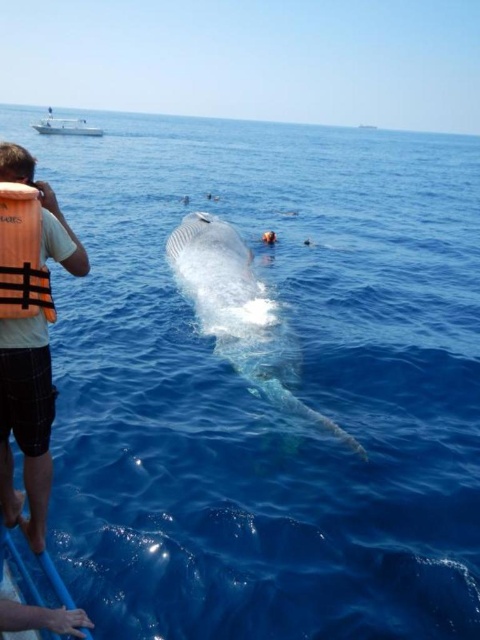
Is orange life vest at left bigger than gray matte whale at center?

No, orange life vest at left is not bigger than gray matte whale at center.

Does orange life vest at left have a smaller size compared to gray matte whale at center?

Indeed, orange life vest at left has a smaller size compared to gray matte whale at center.

Between point (0, 460) and point (172, 250), which one is positioned in front?

Positioned in front is point (0, 460).

What are the coordinates of `orange life vest at left` in the screenshot? It's located at (25, 420).

What do you see at coordinates (25, 420) in the screenshot? I see `orange life vest at left` at bounding box center [25, 420].

Can you confirm if orange life vest at left is shorter than orange fabric life jacket at left?

No.

Does point (49, 388) come farther from viewer compared to point (26, 198)?

That is True.

Image resolution: width=480 pixels, height=640 pixels. Find the location of `orange life vest at left`. orange life vest at left is located at coordinates (25, 420).

Can you confirm if gray matte whale at center is positioned above white glossy boat at upper left?

No.

Between gray matte whale at center and white glossy boat at upper left, which one has more height?

white glossy boat at upper left is taller.

Between point (299, 401) and point (88, 125), which one is positioned behind?

Point (88, 125)

Locate an element on the screen. This screenshot has width=480, height=640. gray matte whale at center is located at coordinates (213, 262).